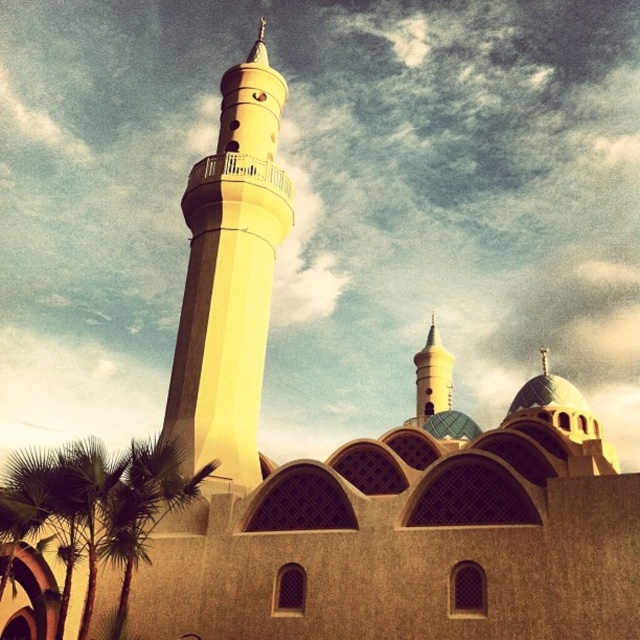
You are standing in front of the mosque and want to take a photo that includes the minaret and the point at coordinates point (275, 131). Based on their distances from you, will the minaret appear closer or farther in the photo compared to the point?

The minaret appears closer in the photo because it is closer to you than the point (275, 131), which is 58.86 meters away.

You are standing at the entrance of the mosque and want to take a photo of the yellow concrete minaret at center. If your camera can only focus on objects within a 0.3 radius from the center point of the image, will the minaret be in focus?

The yellow concrete minaret at center is positioned at point (x=228, y=278). Since the camera can focus within a 0.3 radius from the center point, the distance from the center to the minaret is sqrt. However, since the coordinates are given as fractions of the image dimensions, the Euclidean distance between the center point and the minaret is sqrt. The Euclidean distance between the center point and the minaret is sqrt. The Euclidean distance between the center point and the minaret is sqrt. The Euclidean.

You are standing in front of the mosque and see the point marked at coordinates (228, 278). Based on the image, can you identify which architectural feature this point is located on?

The point marked at coordinates (228, 278) is located on the yellow concrete minaret at center.